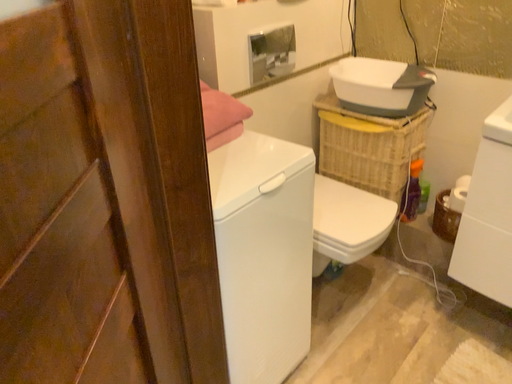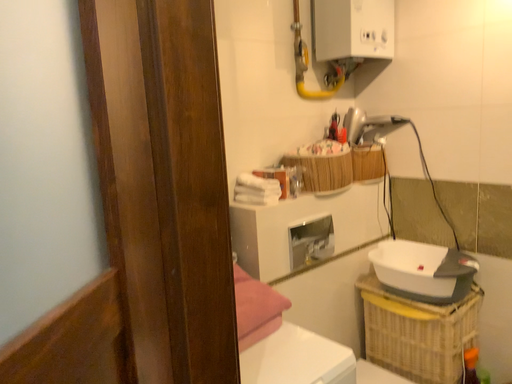
Question: Which way did the camera rotate in the video?

Choices:
 (A) rotated downward
 (B) rotated upward

Answer: (B)